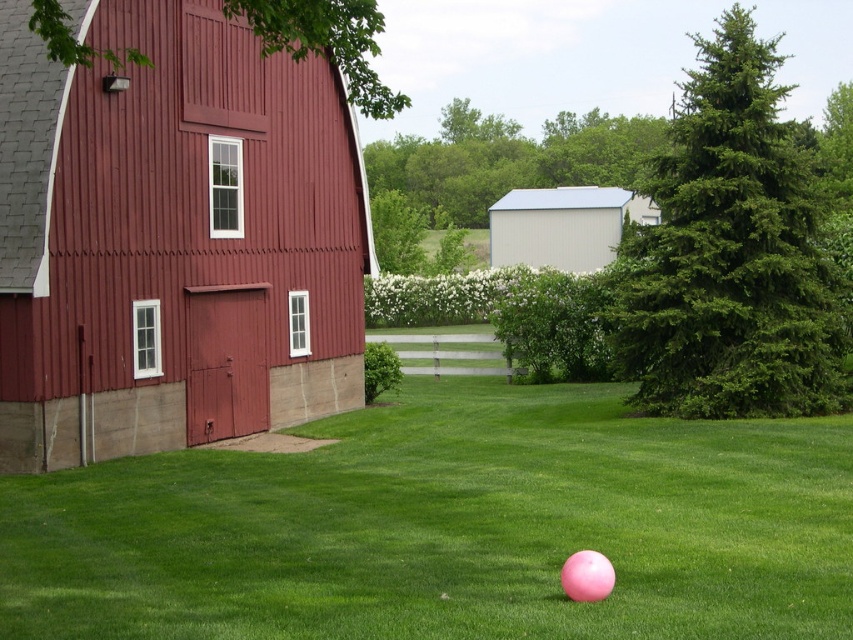
Between point (229, 168) and point (592, 596), which one is positioned behind?

The point (229, 168) is more distant.

Measure the distance between smooth red barn at center and pink rubber ball at lower center.

smooth red barn at center and pink rubber ball at lower center are 13.73 meters apart.

Does point (10, 134) come in front of point (584, 588)?

No.

Where is `smooth red barn at center`? This screenshot has height=640, width=853. smooth red barn at center is located at coordinates (172, 237).

Describe the element at coordinates (445, 528) in the screenshot. I see `green grass at center` at that location.

Which is behind, point (451, 572) or point (123, 280)?

The point (123, 280) is more distant.

Does point (154, 611) lie behind point (331, 140)?

No.

The width and height of the screenshot is (853, 640). I want to click on green grass at center, so click(x=445, y=528).

Can you confirm if white matte shed at center is positioned to the right of pink rubber ball at lower center?

Yes, white matte shed at center is to the right of pink rubber ball at lower center.

Can you confirm if white matte shed at center is positioned above pink rubber ball at lower center?

Yes, white matte shed at center is above pink rubber ball at lower center.

Is point (573, 225) behind point (567, 593)?

Yes, it is.

At what (x,y) coordinates should I click in order to perform the action: click on white matte shed at center. Please return your answer as a coordinate pair (x, y). This screenshot has width=853, height=640. Looking at the image, I should click on coord(563,225).